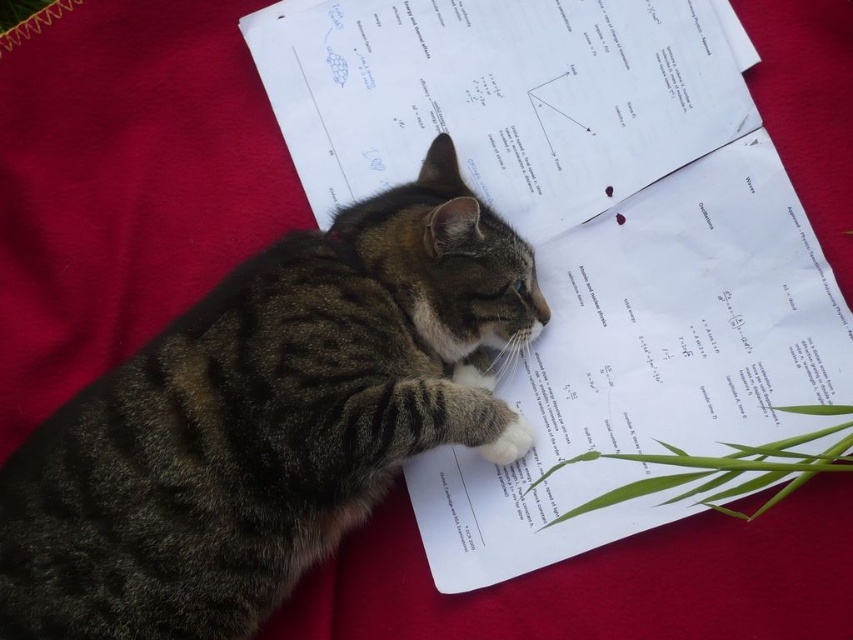
Is tabby fur cat at center behind white fur at center?

No.

Is tabby fur cat at center taller than white fur at center?

Correct, tabby fur cat at center is much taller as white fur at center.

Identify the location of tabby fur cat at center. (265, 420).

This screenshot has height=640, width=853. Identify the location of tabby fur cat at center. (265, 420).

Does white paper at center come behind white fur at center?

No, white paper at center is in front of white fur at center.

Is point (451, 499) less distant than point (514, 422)?

No, (451, 499) is further to viewer.

Which is in front, point (770, 390) or point (509, 452)?

Point (770, 390) is more forward.

This screenshot has height=640, width=853. I want to click on white paper at center, so click(x=646, y=364).

Is tabby fur cat at center positioned behind white paper at center?

No.

Who is taller, tabby fur cat at center or white paper at center?

tabby fur cat at center is taller.

Image resolution: width=853 pixels, height=640 pixels. What do you see at coordinates (265, 420) in the screenshot? I see `tabby fur cat at center` at bounding box center [265, 420].

Identify the location of tabby fur cat at center. The height and width of the screenshot is (640, 853). (265, 420).